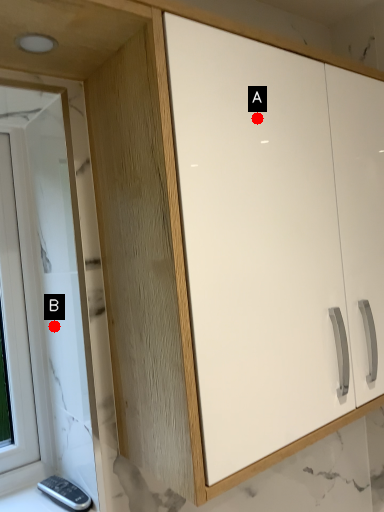
Question: Two points are circled on the image, labeled by A and B beside each circle. Which point is closer to the camera?

Choices:
 (A) A is closer
 (B) B is closer

Answer: (A)